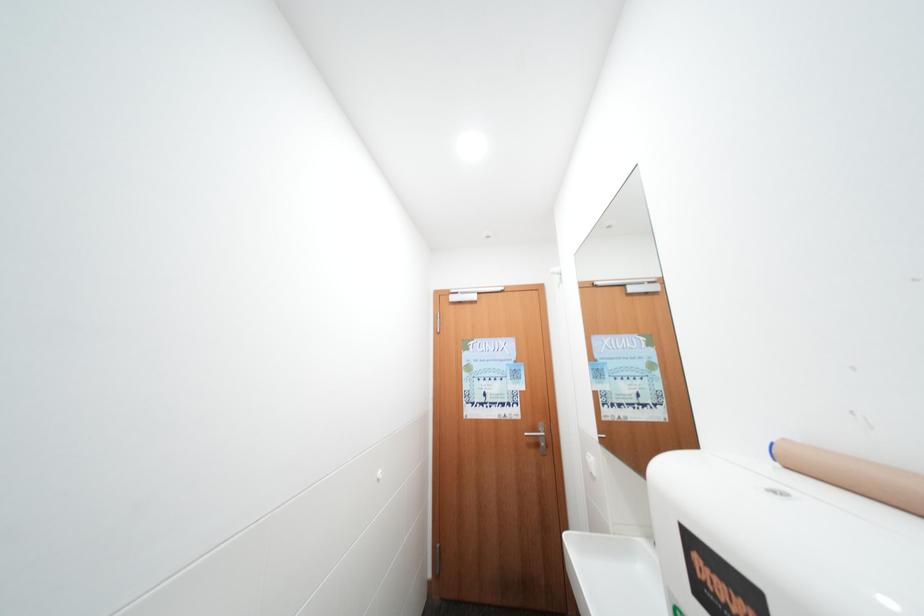
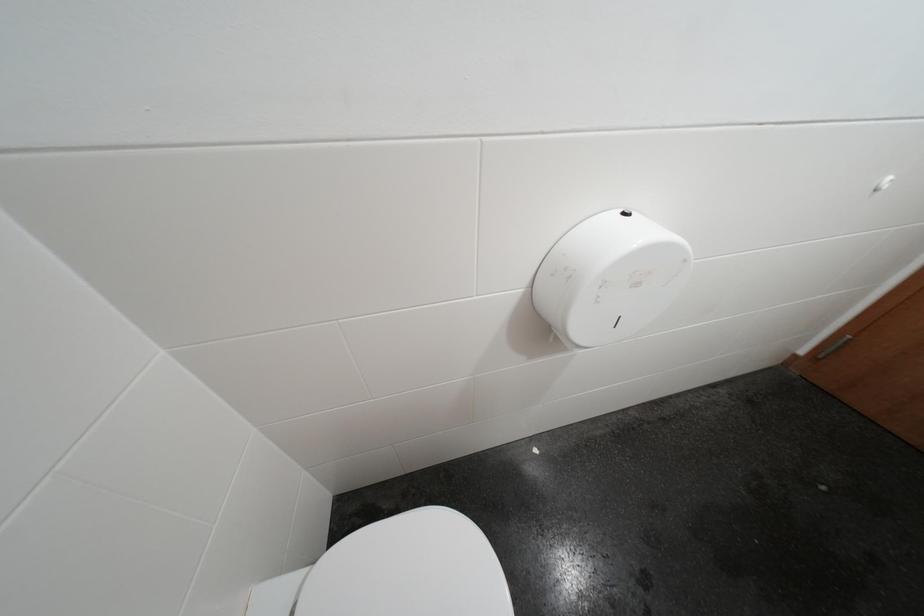
The first image is from the beginning of the video and the second image is from the end. How did the camera likely rotate when shooting the video?

The camera's rotation is toward left-down.